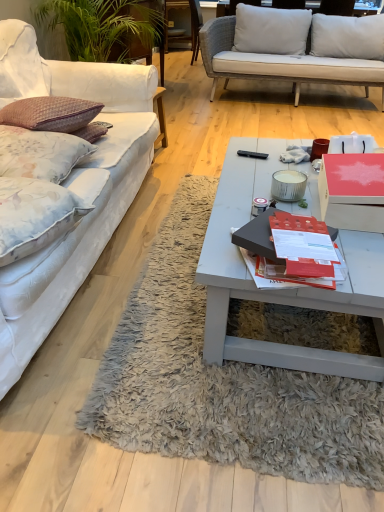
Where is `vacant region to the left of red cardboard box at center`? This screenshot has width=384, height=512. vacant region to the left of red cardboard box at center is located at coordinates (264, 192).